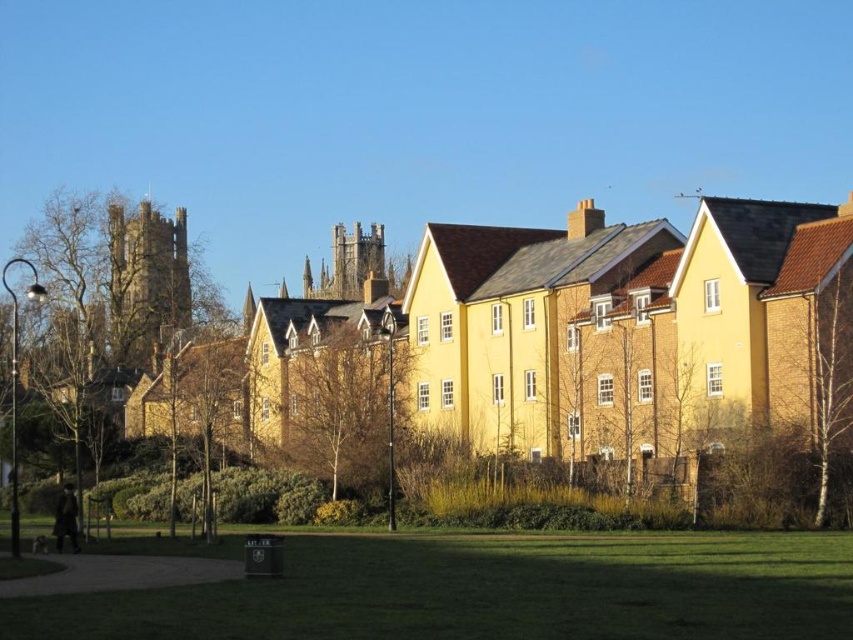
You are a park visitor who wants to take a photo of both the brown textured tree at center and the white textured tree at right. Since you want them both in the frame, which tree should you position closer to you when taking the photo?

To include both the brown textured tree at center and the white textured tree at right in the frame, you should position yourself closer to the brown textured tree at center since it is located to the left of the white textured tree at right, allowing both to be captured within the camera view.

You are a park visitor standing at the entrance of the park. You want to take a photo of both the white textured tree at right and the smooth brown tree at lower left in the same frame. Which direction should you face to ensure both trees are visible in your camera view?

You should face towards the left side of the park so that both the white textured tree at right and the smooth brown tree at lower left are within your camera view, as the white textured tree at right is positioned to the right of the smooth brown tree at lower left.